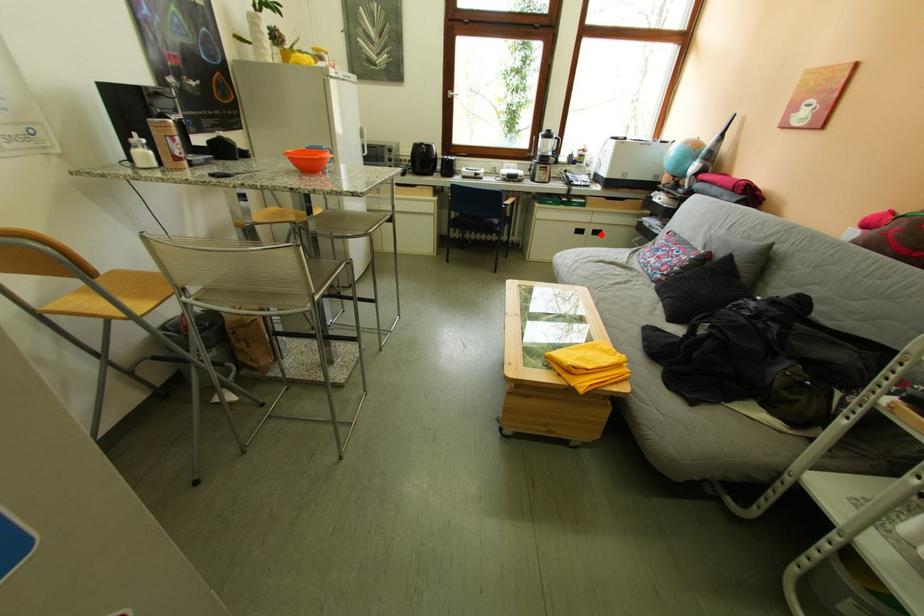
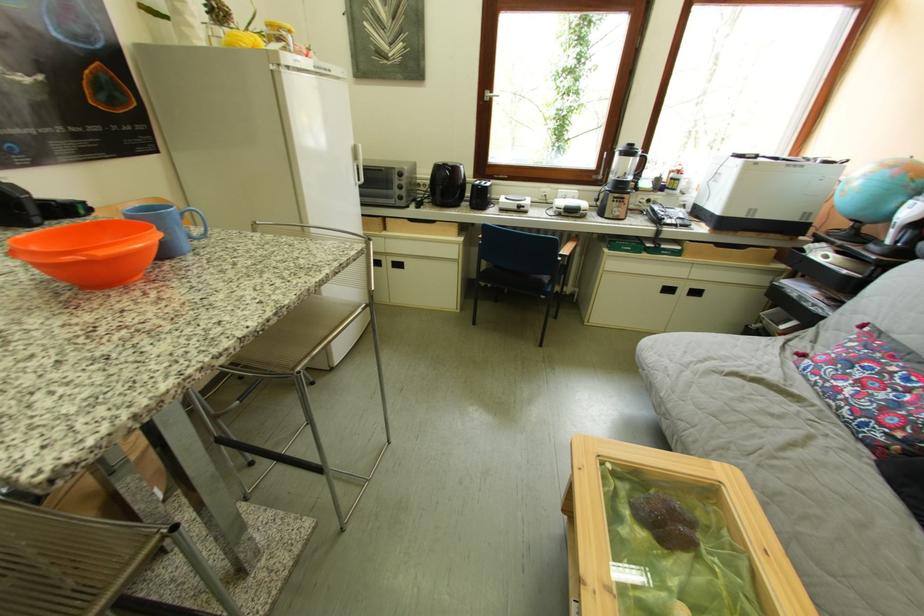
Question: I am providing you with two images of the same scene from different viewpoints. A red point is shown in image1. For the corresponding object point in image2, is it positioned nearer or farther from the camera?

Choices:
 (A) Nearer
 (B) Farther

Answer: (B)